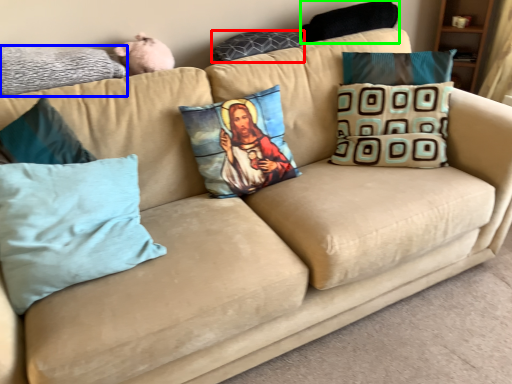
Question: Which is nearer to the pillow (highlighted by a red box)? pillow (highlighted by a blue box) or pillow (highlighted by a green box).

Choices:
 (A) pillow
 (B) pillow

Answer: (B)